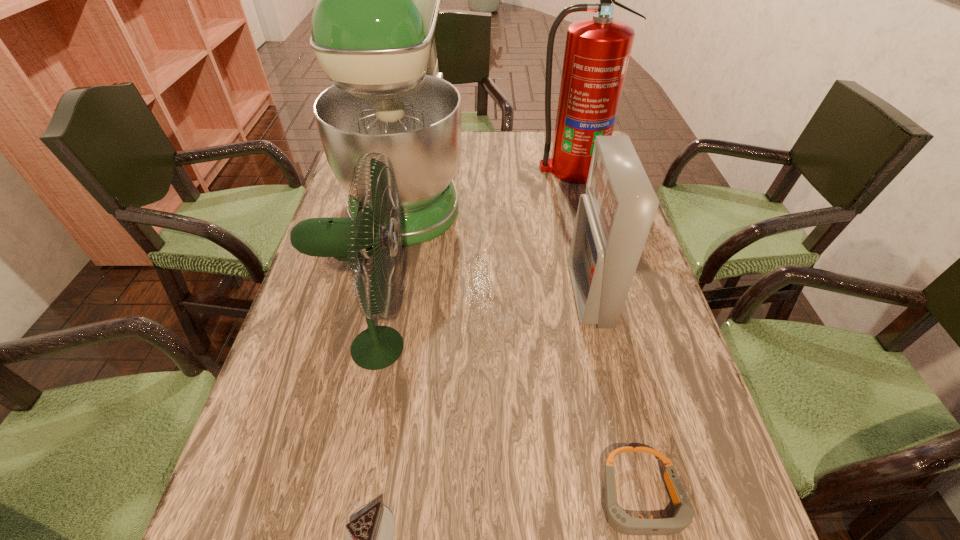
At what (x,y) coordinates should I click in order to perform the action: click on mixer. Please return your answer as a coordinate pair (x, y). Looking at the image, I should click on click(x=373, y=26).

At what (x,y) coordinates should I click in order to perform the action: click on fire extinguisher. Please return your answer as a coordinate pair (x, y). The width and height of the screenshot is (960, 540). Looking at the image, I should click on (597, 51).

Find the location of a particular element. The image size is (960, 540). fan is located at coordinates (355, 239).

Locate an element on the screen. The image size is (960, 540). the third shortest object is located at coordinates (x=614, y=217).

The width and height of the screenshot is (960, 540). In order to click on vacant area located on the controls of the mixer in this screenshot , I will do `click(583, 187)`.

What are the coordinates of `vacant space located 0.210m on the instruction side of the fire extinguisher` in the screenshot? It's located at (588, 230).

Find the location of a particular element. free space located on the front-facing side of the fan is located at coordinates (439, 348).

The image size is (960, 540). I want to click on free space located on the front-facing side of the third shortest object, so click(439, 295).

Where is `free space located 0.260m on the front-facing side of the third shortest object`? The image size is (960, 540). free space located 0.260m on the front-facing side of the third shortest object is located at coordinates (461, 295).

What are the coordinates of `free space located on the front-facing side of the third shortest object` in the screenshot? It's located at (508, 295).